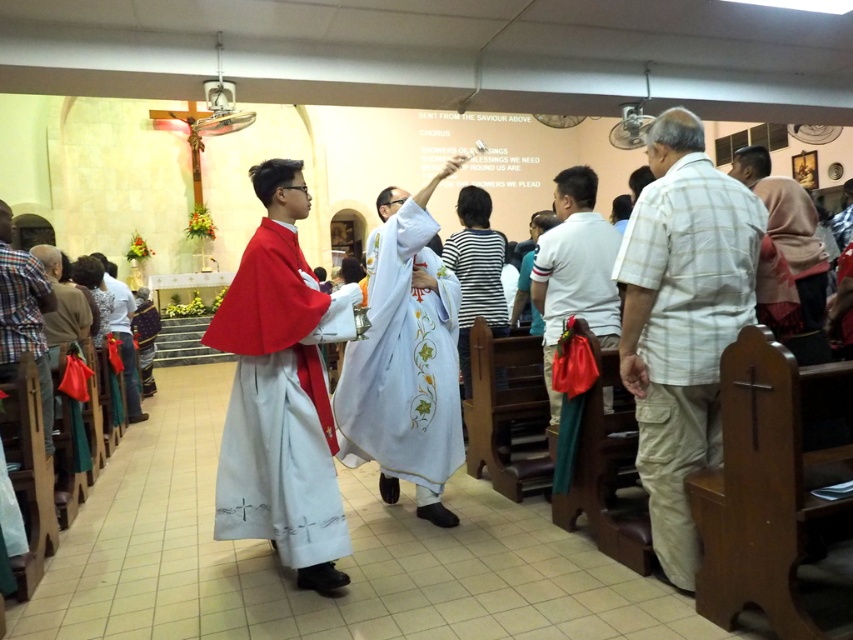
Does light beige plaid shirt at center appear on the left side of plaid cotton shirt at right?

Yes, light beige plaid shirt at center is to the left of plaid cotton shirt at right.

Which is in front, point (660, 118) or point (809, 292)?

Point (660, 118) is in front.

The height and width of the screenshot is (640, 853). Identify the location of light beige plaid shirt at center. (682, 320).

Consider the image. Does white embroidered robe at center have a lesser height compared to white cotton shirt at center?

Incorrect, white embroidered robe at center's height does not fall short of white cotton shirt at center's.

This screenshot has height=640, width=853. Describe the element at coordinates (404, 362) in the screenshot. I see `white embroidered robe at center` at that location.

Describe the element at coordinates (404, 362) in the screenshot. I see `white embroidered robe at center` at that location.

Identify the location of white embroidered robe at center. This screenshot has height=640, width=853. (404, 362).

Which of these two, light beige plaid shirt at center or white cotton shirt at center, stands shorter?

white cotton shirt at center

Does light beige plaid shirt at center appear under white cotton shirt at center?

Yes.

Where is `light beige plaid shirt at center`? The image size is (853, 640). light beige plaid shirt at center is located at coordinates (682, 320).